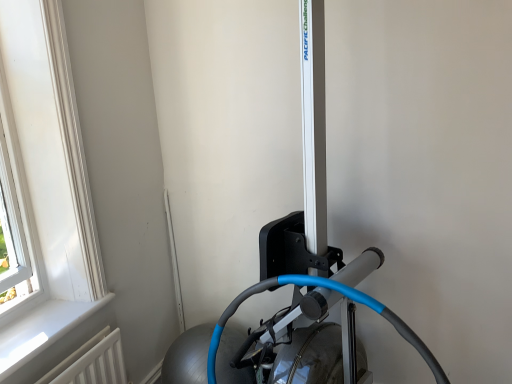
Question: Is white plastic window at upper left not within black rubber rowing machine at center, which is the first sport equipment from bottom to top?

Choices:
 (A) no
 (B) yes

Answer: (B)

Question: Can you confirm if white plastic window at upper left is positioned to the right of black rubber rowing machine at center, which is the first sport equipment from bottom to top?

Choices:
 (A) no
 (B) yes

Answer: (A)

Question: From a real-world perspective, is white plastic window at upper left beneath black rubber rowing machine at center, the 2th sport equipment positioned from the top?

Choices:
 (A) no
 (B) yes

Answer: (A)

Question: Is white plastic window at upper left in front of black rubber rowing machine at center, the 2th sport equipment positioned from the top?

Choices:
 (A) yes
 (B) no

Answer: (B)

Question: Is white plastic window at upper left in contact with black rubber rowing machine at center, the 2th sport equipment positioned from the top?

Choices:
 (A) no
 (B) yes

Answer: (A)

Question: Considering the positions of white painted wood at lower left and white plastic window at upper left in the image, is white painted wood at lower left bigger or smaller than white plastic window at upper left?

Choices:
 (A) small
 (B) big

Answer: (A)

Question: In terms of width, does white painted wood at lower left look wider or thinner when compared to white plastic window at upper left?

Choices:
 (A) thin
 (B) wide

Answer: (B)

Question: Is white painted wood at lower left in front of or behind white plastic window at upper left in the image?

Choices:
 (A) front
 (B) behind

Answer: (B)

Question: From their relative heights in the image, would you say white painted wood at lower left is taller or shorter than white plastic window at upper left?

Choices:
 (A) tall
 (B) short

Answer: (B)

Question: Considering the positions of point (250, 292) and point (286, 365), is point (250, 292) closer or farther from the camera than point (286, 365)?

Choices:
 (A) farther
 (B) closer

Answer: (A)

Question: Is black rubber rowing machine at center, the 2th sport equipment positioned from the top, wider or thinner than silver metallic rowing machine at center, the second sport equipment ordered from the bottom?

Choices:
 (A) thin
 (B) wide

Answer: (A)

Question: Is black rubber rowing machine at center, which is the first sport equipment from bottom to top, taller or shorter than silver metallic rowing machine at center, arranged as the 1th sport equipment when viewed from the top?

Choices:
 (A) short
 (B) tall

Answer: (A)

Question: Is black rubber rowing machine at center, which is the first sport equipment from bottom to top, spatially inside silver metallic rowing machine at center, the second sport equipment ordered from the bottom, or outside of it?

Choices:
 (A) inside
 (B) outside

Answer: (A)

Question: Is white plastic window at upper left to the left or to the right of silver metallic rowing machine at center, arranged as the 1th sport equipment when viewed from the top, in the image?

Choices:
 (A) right
 (B) left

Answer: (B)

Question: Is point (74, 119) positioned closer to the camera than point (375, 261)?

Choices:
 (A) closer
 (B) farther

Answer: (A)